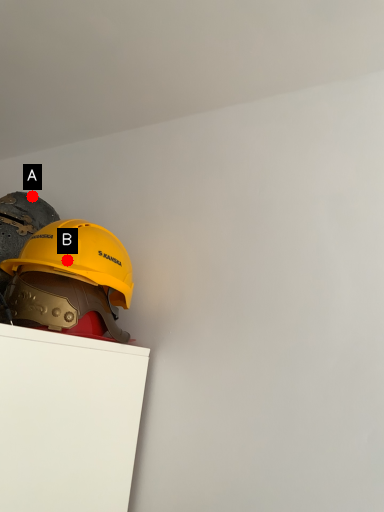
Question: Two points are circled on the image, labeled by A and B beside each circle. Which of the following is the farthest from the observer?

Choices:
 (A) A is further
 (B) B is further

Answer: (A)